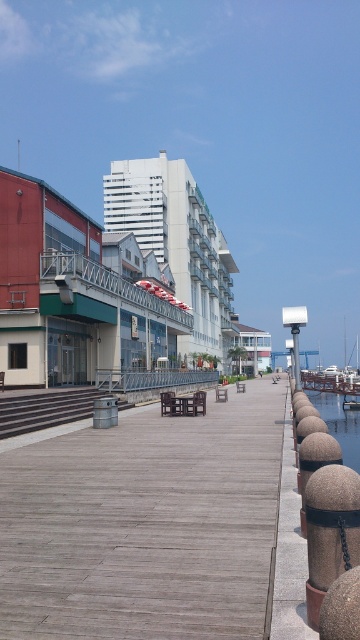
What are the coordinates of the gray wood boardwalk at center?

The gray wood boardwalk at center is located at coordinates point (146, 525).

You are standing on the waterfront promenade and want to take a photo of both the point at coordinates (x=164, y=300) and the point at (x=96, y=380). Based on their positions, which point will appear closer to the camera in your photo?

Point (x=96, y=380) will appear closer to the camera in the photo because it is physically closer to the camera than point (x=164, y=300), which is further away.

You are a delivery person trying to park your 1.2 meter wide cart on the waterfront promenade. You see the gray wood boardwalk at center and the wooden dock at center. Which area can accommodate your cart without overlapping the bollards?

The gray wood boardwalk at center is wider than the wooden dock at center, so the cart can fit on the gray wood boardwalk at center as it has more space between the bollards.